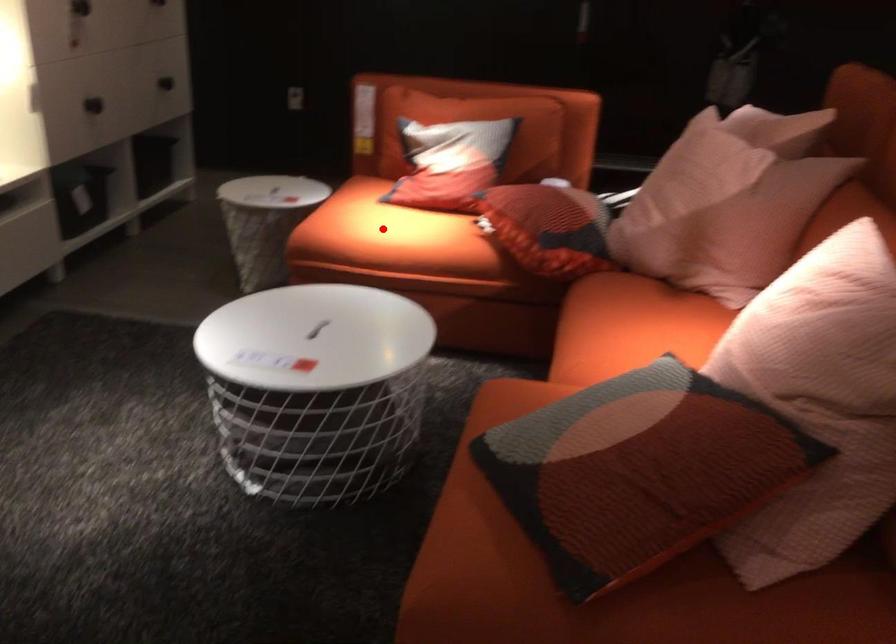
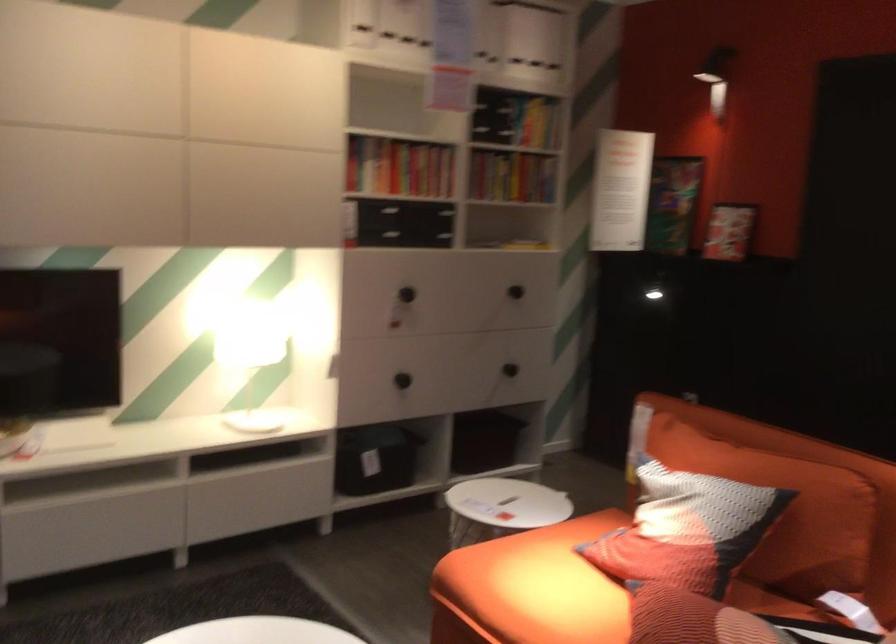
Locate, in the second image, the point that corresponds to the highlighted location in the first image.

(531, 588)